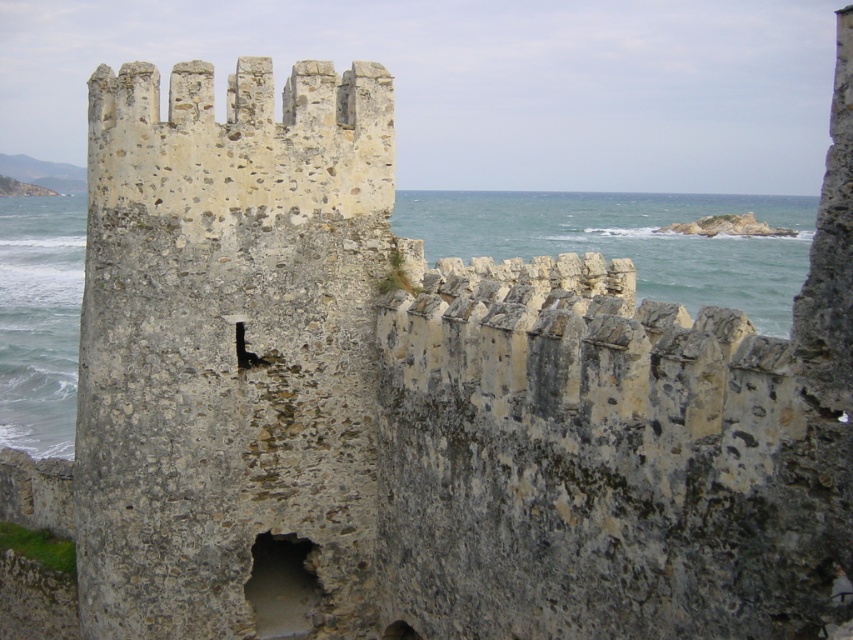
You are a drone operator trying to capture a photo of the clear water at center. The drone is currently hovering at point 0.377, 0.739. Is the drone positioned correctly to take the photo?

The clear water at center is located at point (630, 241), so yes, the drone is correctly positioned at that coordinate to capture the photo.

You are a tourist standing in front of the stone wall. You see the clear water at center and the dark gray stone hole at center. Which object is closer to you?

The clear water at center is closer to you because it is further to the viewer than the dark gray stone hole at center.

You are a sailor who has just discovered a hidden cove with a stone wall and a mysterious hole. You have a small fishing net that can cover an area of 1 square meter. Which object between the clear water at center and the dark gray stone hole at center would be suitable to place the net over?

The clear water at center is larger in size than the dark gray stone hole at center, so the net can be placed over the clear water at center since it is big enough to accommodate the net.